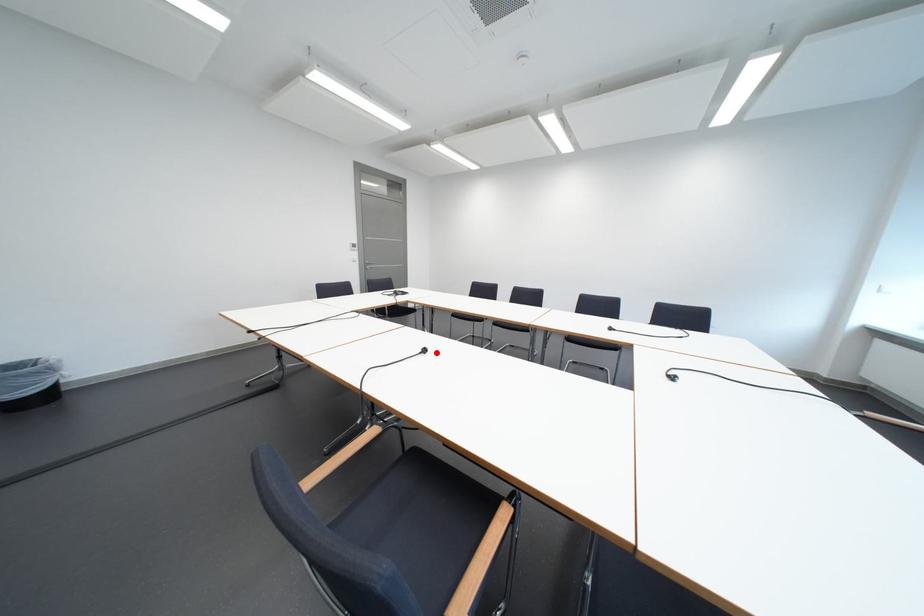
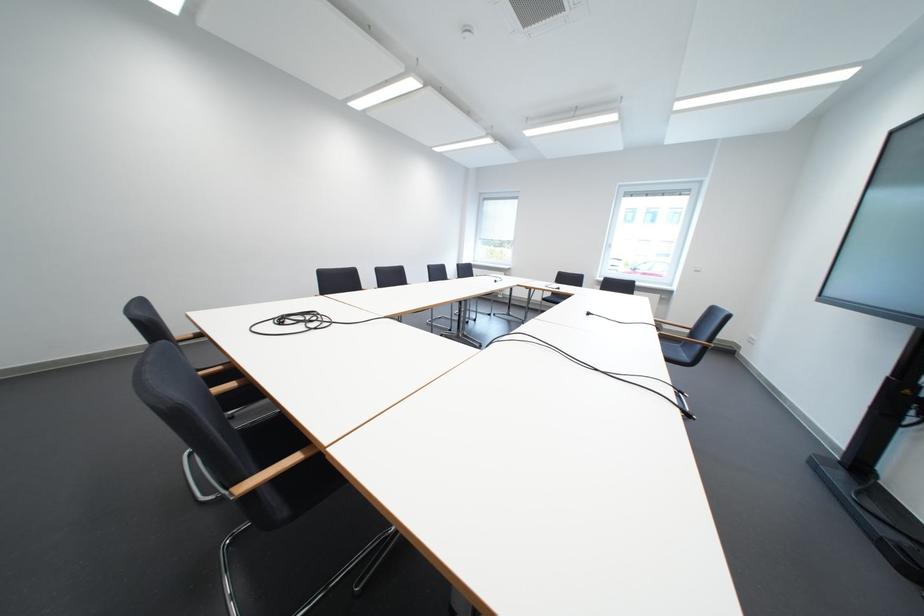
Where in the second image is the point corresponding to the highlighted location from the first image?

(601, 315)